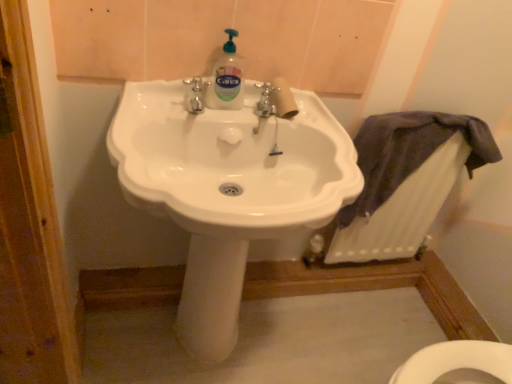
Question: Does white textured radiator at lower right have a lesser height compared to white glossy sink at center?

Choices:
 (A) yes
 (B) no

Answer: (A)

Question: Is white textured radiator at lower right turned away from white glossy sink at center?

Choices:
 (A) no
 (B) yes

Answer: (A)

Question: Does white textured radiator at lower right touch white glossy sink at center?

Choices:
 (A) no
 (B) yes

Answer: (A)

Question: Is white textured radiator at lower right not close to white glossy sink at center?

Choices:
 (A) no
 (B) yes

Answer: (A)

Question: Is white glossy sink at center surrounded by white textured radiator at lower right?

Choices:
 (A) no
 (B) yes

Answer: (A)

Question: Based on their sizes in the image, would you say translucent plastic bottle at center is bigger or smaller than white textured radiator at lower right?

Choices:
 (A) big
 (B) small

Answer: (B)

Question: Is translucent plastic bottle at center in front of or behind white textured radiator at lower right in the image?

Choices:
 (A) behind
 (B) front

Answer: (B)

Question: Is point (240, 82) closer or farther from the camera than point (380, 213)?

Choices:
 (A) closer
 (B) farther

Answer: (A)

Question: From a real-world perspective, is translucent plastic bottle at center positioned above or below white textured radiator at lower right?

Choices:
 (A) below
 (B) above

Answer: (B)

Question: In terms of size, does translucent plastic bottle at center appear bigger or smaller than white glossy sink at center?

Choices:
 (A) big
 (B) small

Answer: (B)

Question: From their relative heights in the image, would you say translucent plastic bottle at center is taller or shorter than white glossy sink at center?

Choices:
 (A) short
 (B) tall

Answer: (A)

Question: Is translucent plastic bottle at center wider or thinner than white glossy sink at center?

Choices:
 (A) wide
 (B) thin

Answer: (B)

Question: Considering the positions of point (238, 97) and point (335, 127), is point (238, 97) closer or farther from the camera than point (335, 127)?

Choices:
 (A) closer
 (B) farther

Answer: (B)

Question: Does point coord(138,87) appear closer or farther from the camera than point coord(238,92)?

Choices:
 (A) closer
 (B) farther

Answer: (A)

Question: In the image, is white glossy sink at center positioned in front of or behind translucent plastic bottle at center?

Choices:
 (A) behind
 (B) front

Answer: (B)